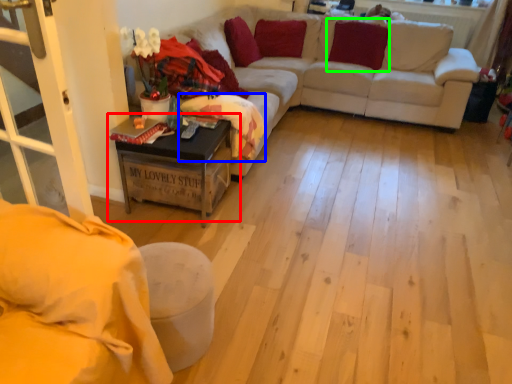
Question: Estimate the real-world distances between objects in this image. Which object is farther from table (highlighted by a red box), blanket (highlighted by a blue box) or pillow (highlighted by a green box)?

Choices:
 (A) blanket
 (B) pillow

Answer: (B)